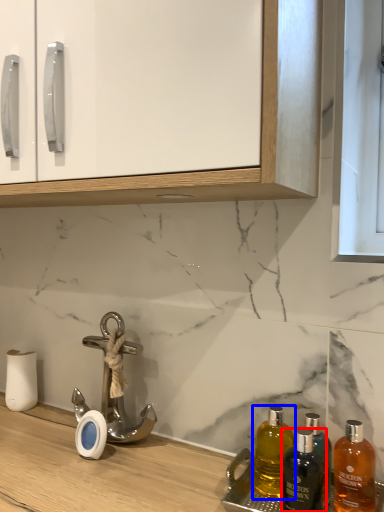
Question: Which object appears farthest to the camera in this image, bottle (highlighted by a red box) or bottle (highlighted by a blue box)?

Choices:
 (A) bottle
 (B) bottle

Answer: (A)